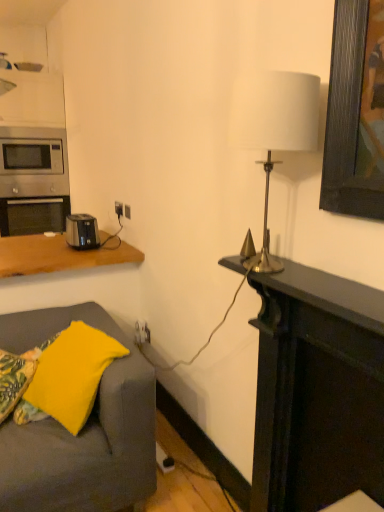
Question: Is satin silver microwave at left wider than black plastic outlet at center?

Choices:
 (A) no
 (B) yes

Answer: (B)

Question: Considering the relative sizes of satin silver microwave at left and black plastic outlet at center in the image provided, is satin silver microwave at left taller than black plastic outlet at center?

Choices:
 (A) no
 (B) yes

Answer: (B)

Question: Is satin silver microwave at left thinner than black plastic outlet at center?

Choices:
 (A) yes
 (B) no

Answer: (B)

Question: Is the depth of satin silver microwave at left less than that of black plastic outlet at center?

Choices:
 (A) yes
 (B) no

Answer: (B)

Question: Is satin silver microwave at left at the left side of black plastic outlet at center?

Choices:
 (A) yes
 (B) no

Answer: (A)

Question: Would you say satin silver microwave at left is outside black plastic outlet at center?

Choices:
 (A) no
 (B) yes

Answer: (B)

Question: From the image's perspective, is black plastic toaster at left above satin silver microwave at left?

Choices:
 (A) yes
 (B) no

Answer: (B)

Question: Is black plastic toaster at left positioned beyond the bounds of satin silver microwave at left?

Choices:
 (A) yes
 (B) no

Answer: (A)

Question: From the image's perspective, does black plastic toaster at left appear lower than satin silver microwave at left?

Choices:
 (A) no
 (B) yes

Answer: (B)

Question: Is black plastic toaster at left closer to camera compared to satin silver microwave at left?

Choices:
 (A) no
 (B) yes

Answer: (B)

Question: From a real-world perspective, is black plastic toaster at left over satin silver microwave at left?

Choices:
 (A) no
 (B) yes

Answer: (A)

Question: Does black plastic toaster at left appear on the left side of satin silver microwave at left?

Choices:
 (A) no
 (B) yes

Answer: (A)

Question: Would you consider stainless steel oven at left to be distant from dark wood fireplace at right?

Choices:
 (A) yes
 (B) no

Answer: (A)